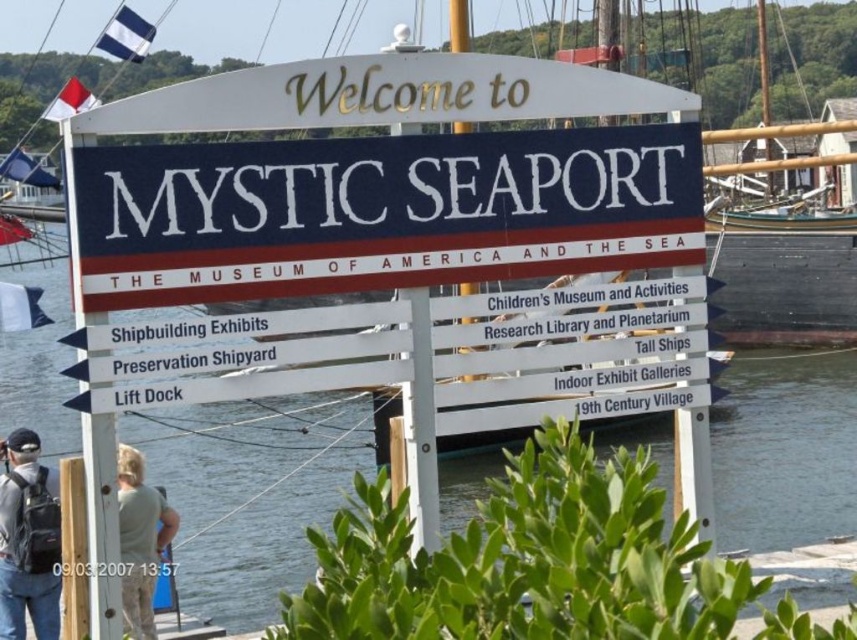
Question: Estimate the real-world distances between objects in this image. Which object is farther from the clear water at center?

Choices:
 (A) wooden ship at center
 (B) matte black backpack at lower left

Answer: (B)

Question: Can you confirm if white painted wood sign at center is bigger than matte black backpack at lower left?

Choices:
 (A) yes
 (B) no

Answer: (A)

Question: Can you confirm if white painted wood sign at center is positioned to the left of green fabric shirt at lower left?

Choices:
 (A) no
 (B) yes

Answer: (A)

Question: Based on their relative distances, which object is farther from the clear water at center?

Choices:
 (A) wooden ship at center
 (B) green fabric shirt at lower left

Answer: (B)

Question: Which point appears closest to the camera in this image?

Choices:
 (A) (752, 525)
 (B) (142, 516)

Answer: (B)

Question: Is white painted wood sign at center to the left of green fabric shirt at lower left from the viewer's perspective?

Choices:
 (A) yes
 (B) no

Answer: (B)